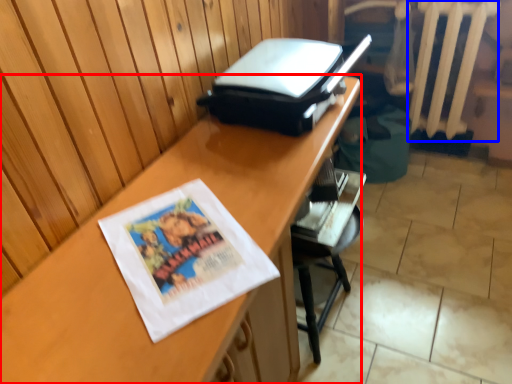
Question: Which object appears farthest to the camera in this image, desk (highlighted by a red box) or radiator (highlighted by a blue box)?

Choices:
 (A) desk
 (B) radiator

Answer: (B)